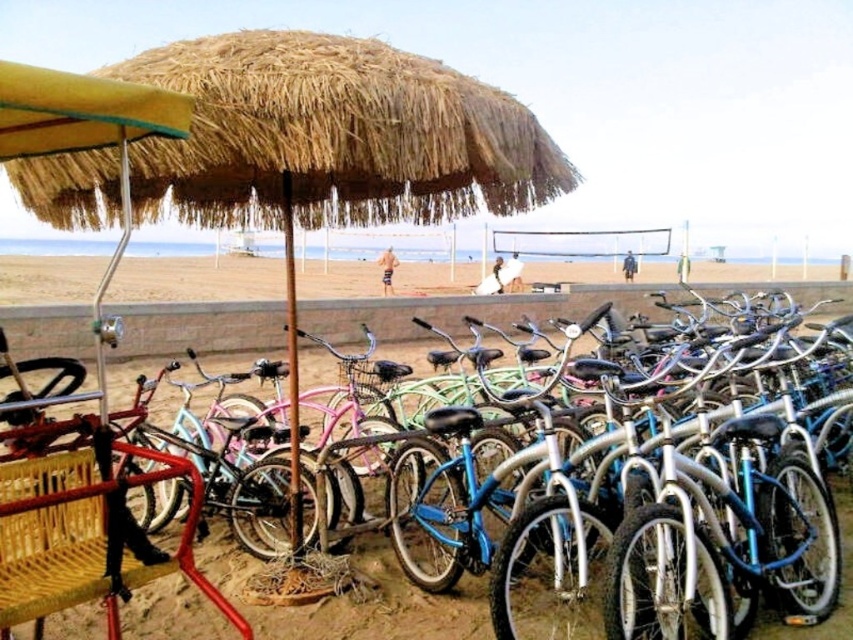
You are a beachgoer who wants to place a 10 cm wide item on the ground. You have two options in the scene, the straw at upper center and the beige sand at center. Which location can accommodate the item based on their widths?

The beige sand at center can accommodate the 10 cm wide item because the straw at upper center is narrower than the beige sand at center.

You are a beachgoer who wants to find a straw to drink your smoothie. You see the straw at upper center and the beige sand at center. Where would you look for the straw?

The straw at upper center is positioned under the beige sand at center, so you should look under the beige sand at center to find the straw.

You are a tourist at the beach and want to take a photo of the blue matte bicycle at center and the beige sand at center. Which object is located to the right of the other?

The blue matte bicycle at center is positioned on the right side of beige sand at center.